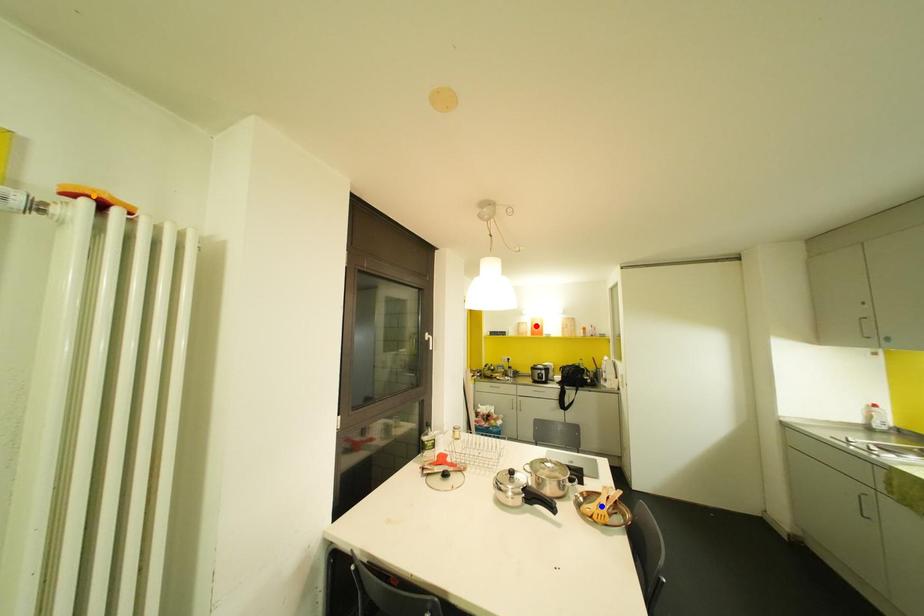
Order these from farthest to nearest:
red point | orange point | blue point

red point → blue point → orange point